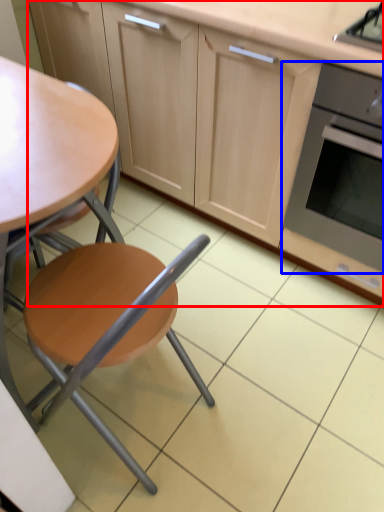
Question: Which of the following is the closest to the observer, cabinetry (highlighted by a red box) or kitchen appliance (highlighted by a blue box)?

Choices:
 (A) cabinetry
 (B) kitchen appliance

Answer: (A)